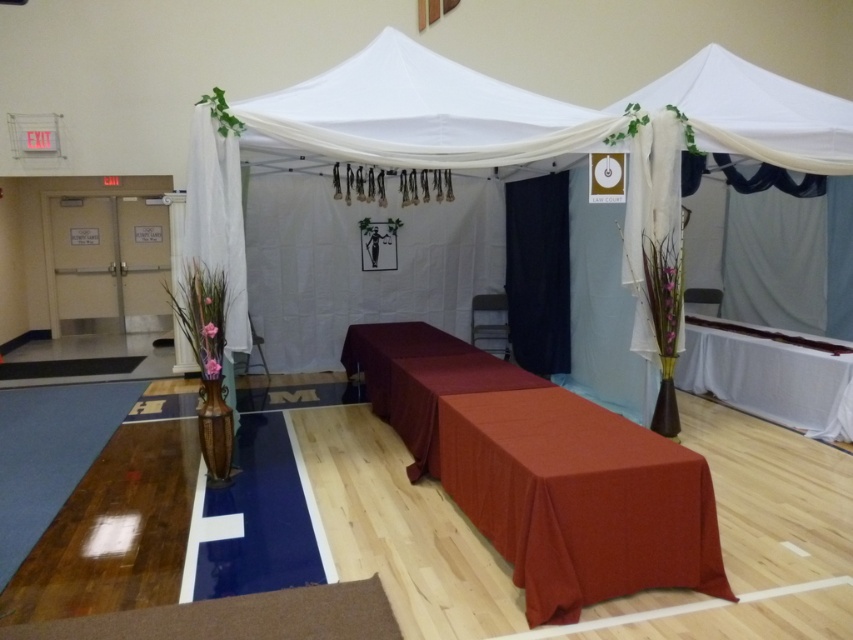
Question: Which of the following is the farthest from the observer?

Choices:
 (A) matte red tablecloth at center
 (B) burgundy satin tablecloth at center
 (C) white fabric tent at center
 (D) brown carpet at lower left

Answer: (C)

Question: Which point appears farthest from the camera in this image?

Choices:
 (A) (550, 310)
 (B) (486, 368)
 (C) (608, 563)

Answer: (A)

Question: Is smooth white table at right wider than burgundy satin tablecloth at center?

Choices:
 (A) no
 (B) yes

Answer: (A)

Question: Can you confirm if white fabric tent at center is smaller than matte red tablecloth at center?

Choices:
 (A) no
 (B) yes

Answer: (A)

Question: Which of these objects is positioned farthest from the white fabric tent at center?

Choices:
 (A) brown carpet at lower left
 (B) white sheer curtain at left
 (C) matte red tablecloth at center
 (D) burgundy satin tablecloth at center

Answer: (A)

Question: In this image, where is white fabric tent at center located relative to matte red tablecloth at center?

Choices:
 (A) left
 (B) right

Answer: (B)